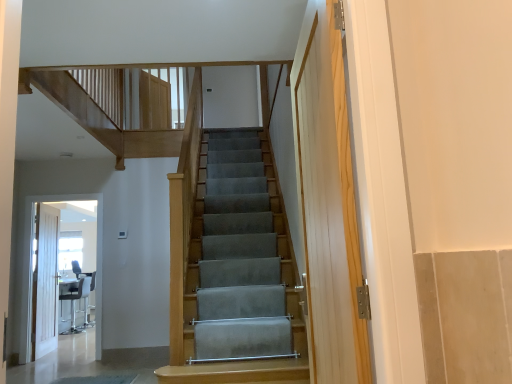
Question: In terms of height, does white painted wooden door at left look taller or shorter compared to white glossy door at left?

Choices:
 (A) short
 (B) tall

Answer: (A)

Question: Considering their positions, is white painted wooden door at left located in front of or behind white glossy door at left?

Choices:
 (A) front
 (B) behind

Answer: (B)

Question: Which object is positioned farthest from the matte black chair at lower left?

Choices:
 (A) white painted wooden door at left
 (B) white glossy door at left

Answer: (B)

Question: Which of these objects is positioned farthest from the white glossy door at left?

Choices:
 (A) white painted wooden door at left
 (B) matte black chair at lower left

Answer: (B)